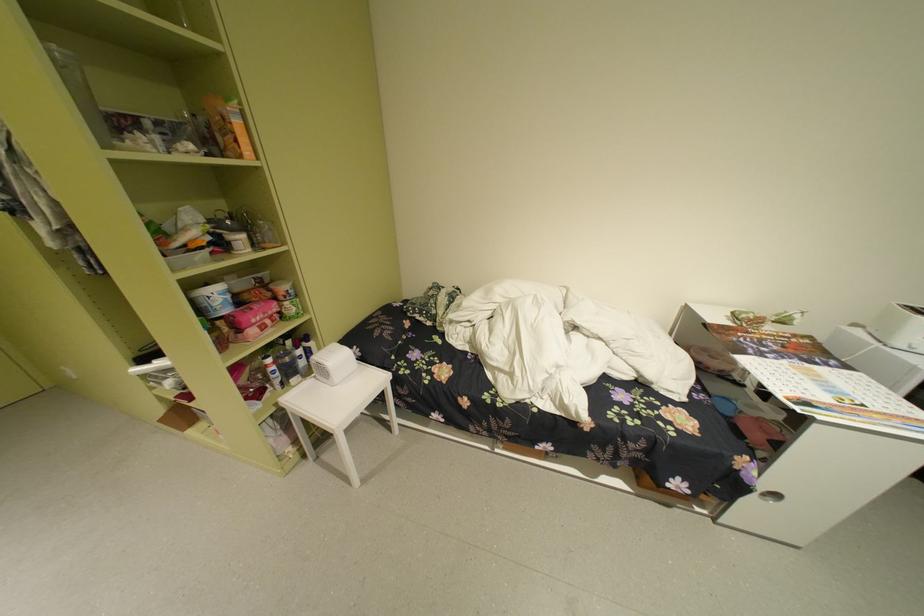
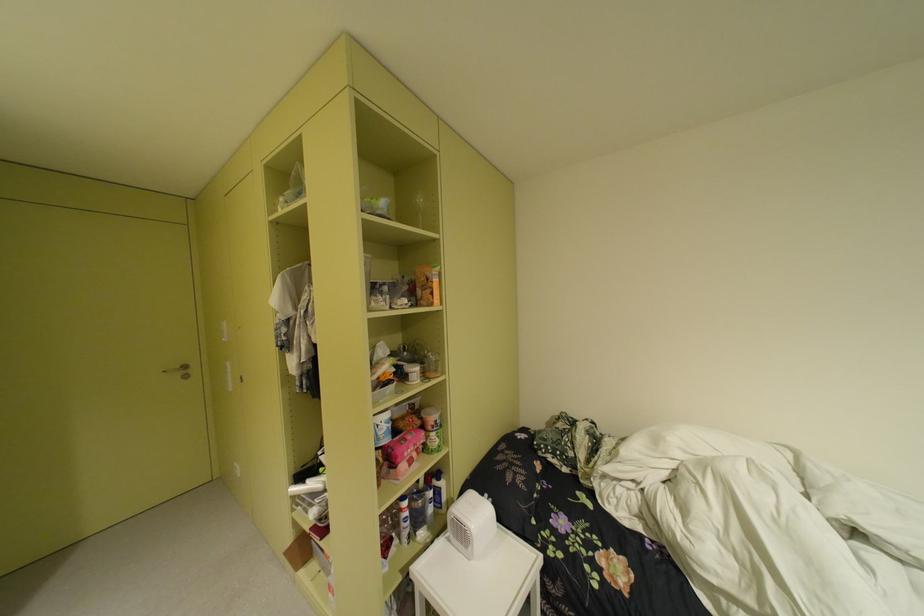
The point at (319,373) is marked in the first image. Where is the corresponding point in the second image?

(451, 529)